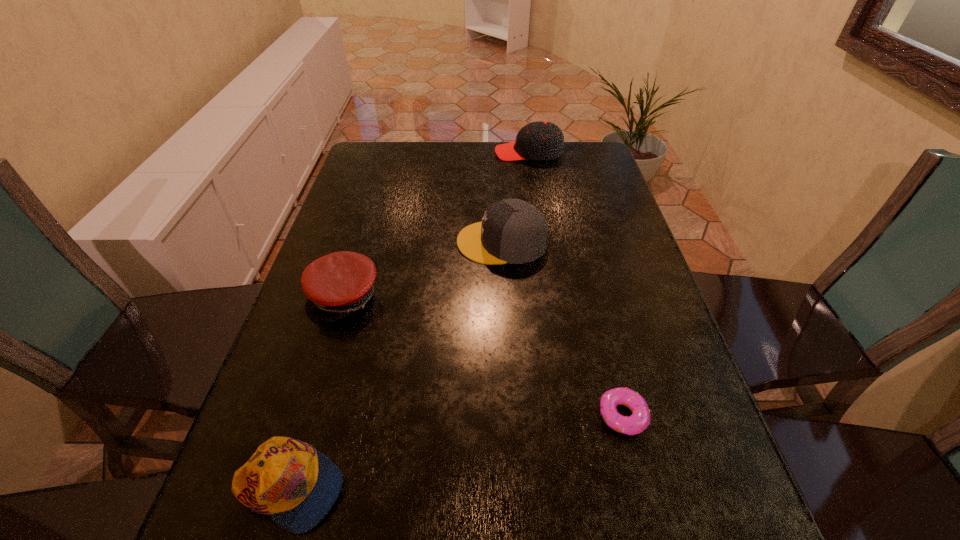
At what (x,y) coordinates should I click in order to perform the action: click on vacant area between the second nearest object and the nearest cap. Please return your answer as a coordinate pair (x, y). The width and height of the screenshot is (960, 540). Looking at the image, I should click on (456, 451).

Locate an element on the screen. The width and height of the screenshot is (960, 540). free spot between the fourth farthest object and the third farthest object is located at coordinates (484, 356).

Where is `object that stands as the closest to the farthest cap`? The height and width of the screenshot is (540, 960). object that stands as the closest to the farthest cap is located at coordinates (513, 231).

In order to click on object that is the third closest to the farthest object in this screenshot , I will do `click(640, 419)`.

This screenshot has height=540, width=960. Identify the location of the second closest cap to the third nearest object. (296, 485).

I want to click on the third closest cap to the second farthest object, so click(x=296, y=485).

The height and width of the screenshot is (540, 960). What are the coordinates of `vacant space that satisfies the following two spatial constraints: 1. on the back side of the shortest object; 2. on the front-facing side of the farthest object` in the screenshot? It's located at (557, 153).

Find the location of a particular element. vacant area that satisfies the following two spatial constraints: 1. on the front-facing side of the doughnut; 2. on the right side of the farthest object is located at coordinates (570, 415).

You are a GUI agent. You are given a task and a screenshot of the screen. Output one action in this format:
    pyautogui.click(x=<x>, y=<y>)
    Task: Click on the free spot that satisfies the following two spatial constraints: 1. on the front-facing side of the fourth nearest object; 2. on the back side of the doughnut
    
    Given the screenshot: What is the action you would take?
    pyautogui.click(x=511, y=415)

In order to click on vacant space that satisfies the following two spatial constraints: 1. on the front-facing side of the doughnut; 2. on the left side of the third nearest cap in this screenshot , I will do `click(511, 415)`.